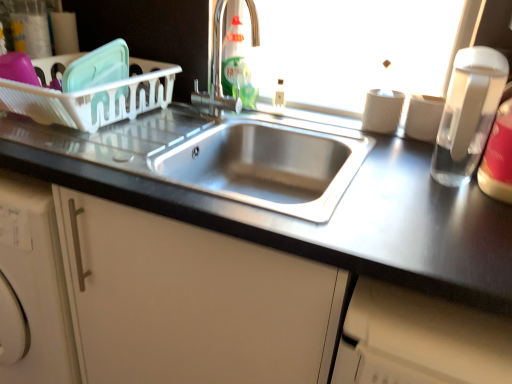
You are a GUI agent. You are given a task and a screenshot of the screen. Output one action in this format:
    pyautogui.click(x=<x>, y=<y>)
    Task: Click on the vacant point to the right of satin nickel faucet at upper center
    
    Given the screenshot: What is the action you would take?
    pyautogui.click(x=284, y=123)